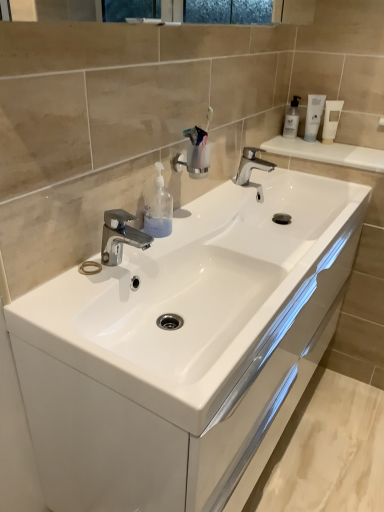
This screenshot has width=384, height=512. Identify the location of free point in front of transparent plastic soap dispenser at center. tap(140, 257).